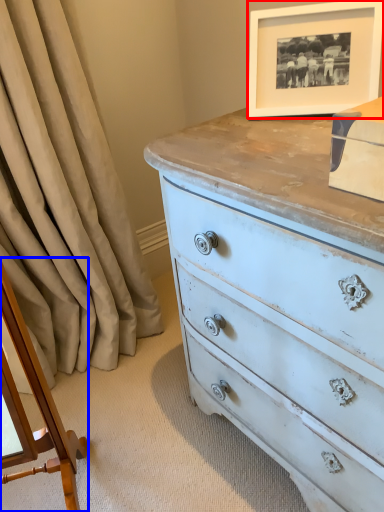
Question: Which point is further to the camera, picture frame (highlighted by a red box) or changing table (highlighted by a blue box)?

Choices:
 (A) picture frame
 (B) changing table

Answer: (A)